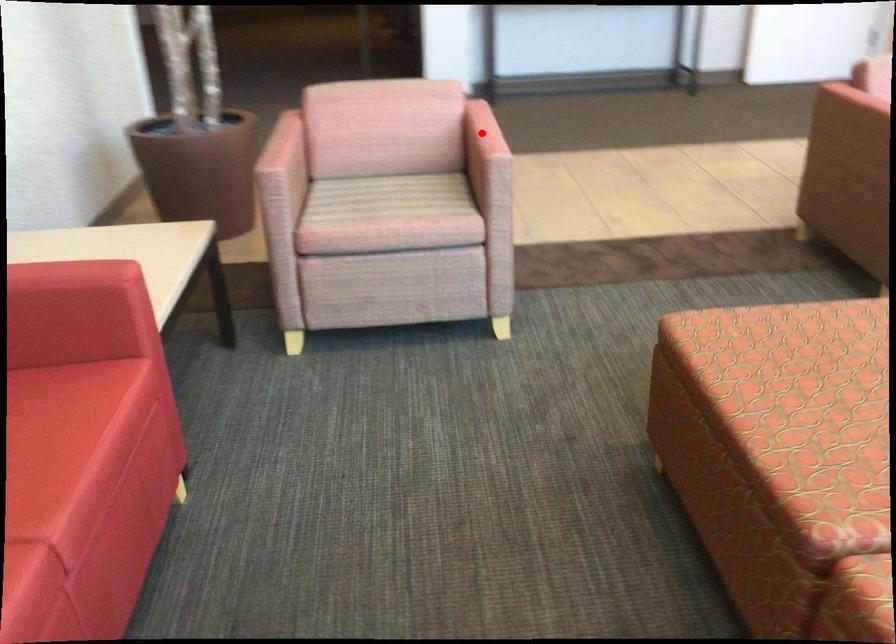
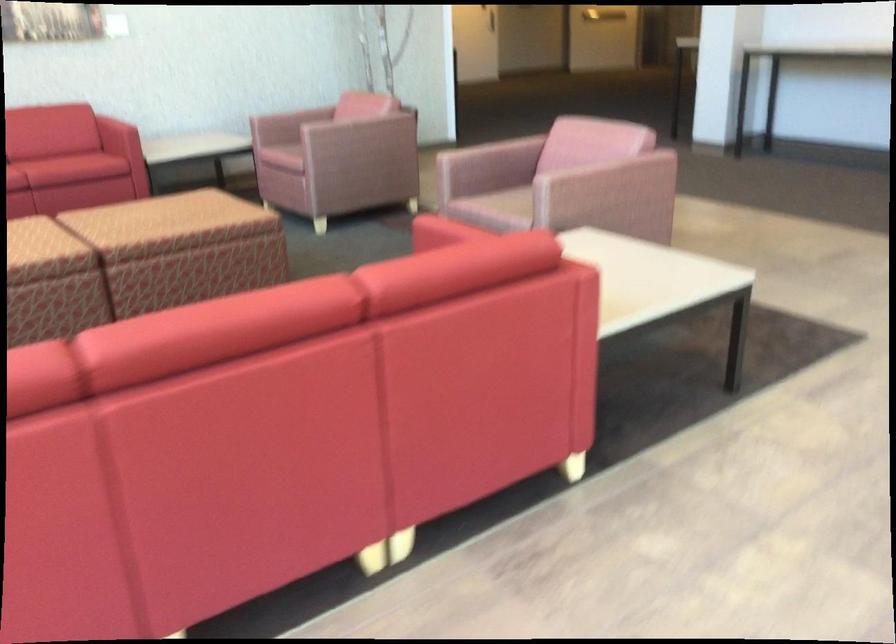
Question: I am providing you with two images of the same scene from different viewpoints. A red point is marked on the first image. Can you still see the location of the red point in image 2?

Choices:
 (A) Yes
 (B) No

Answer: (B)